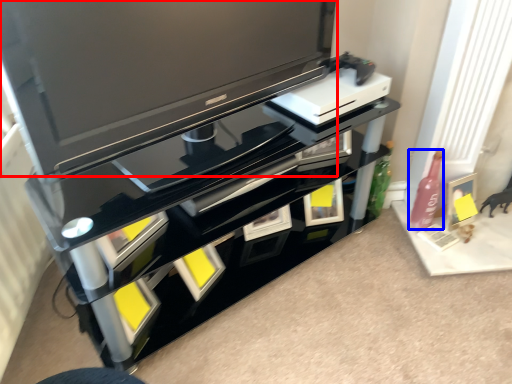
Question: Which point is closer to the camera, television (highlighted by a red box) or bottle (highlighted by a blue box)?

Choices:
 (A) television
 (B) bottle

Answer: (A)